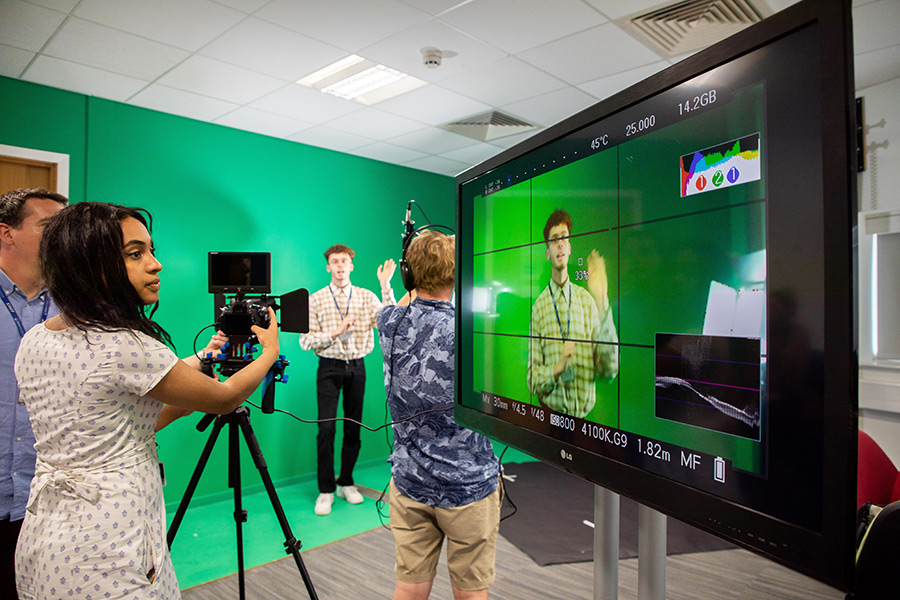
Find the location of a particular element. The image size is (900, 600). monitor is located at coordinates (689, 276).